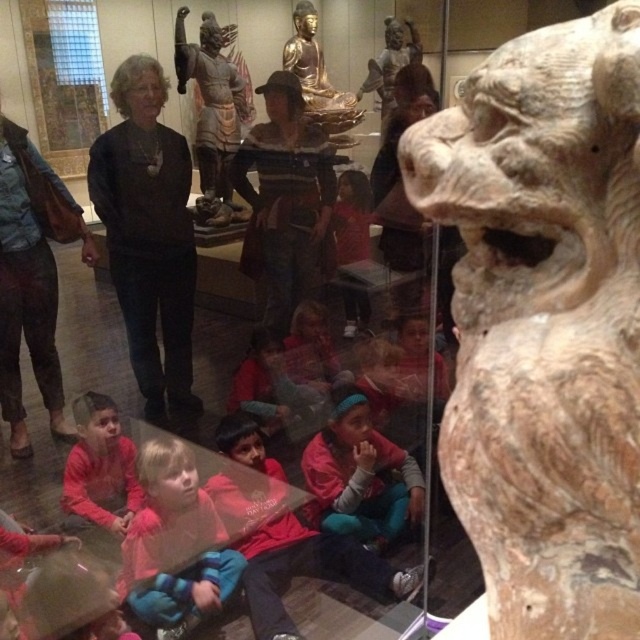
Question: Does dark brown sweater at center have a greater width compared to gold polished statue at center?

Choices:
 (A) no
 (B) yes

Answer: (A)

Question: Can you confirm if pink fabric at center is positioned to the right of red shirt at center?

Choices:
 (A) yes
 (B) no

Answer: (B)

Question: Which point is closer to the camera?

Choices:
 (A) (490, 116)
 (B) (260, 600)
 (C) (246, 115)

Answer: (A)

Question: Which object is closer to the camera taking this photo?

Choices:
 (A) pink fabric at center
 (B) matte red shirt at lower left
 (C) smooth pink shirt at center
 (D) beige stone lion at right

Answer: (D)

Question: Which point is farther to the camera?

Choices:
 (A) (442, 113)
 (B) (333, 212)
 (C) (225, 112)

Answer: (C)

Question: Can you confirm if pink fabric at center is positioned below red shirt at center?

Choices:
 (A) yes
 (B) no

Answer: (A)